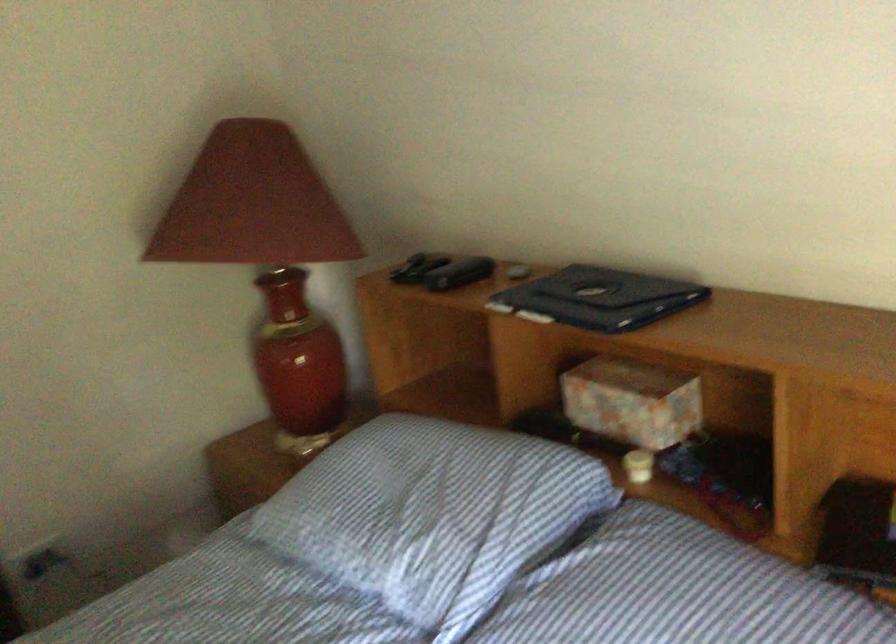
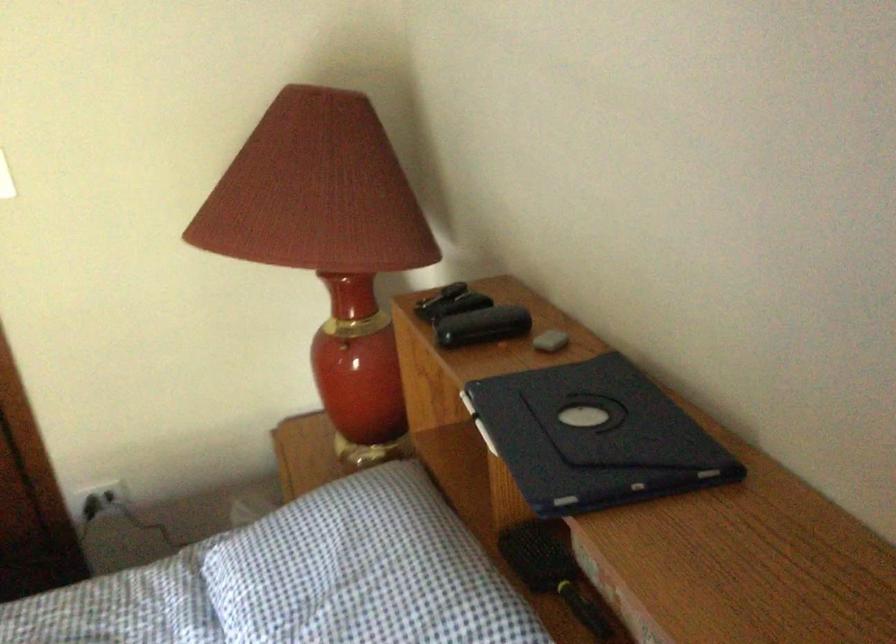
The images are taken continuously from a first-person perspective. In which direction are you moving?

The movement direction of the cameraman is right, forward.